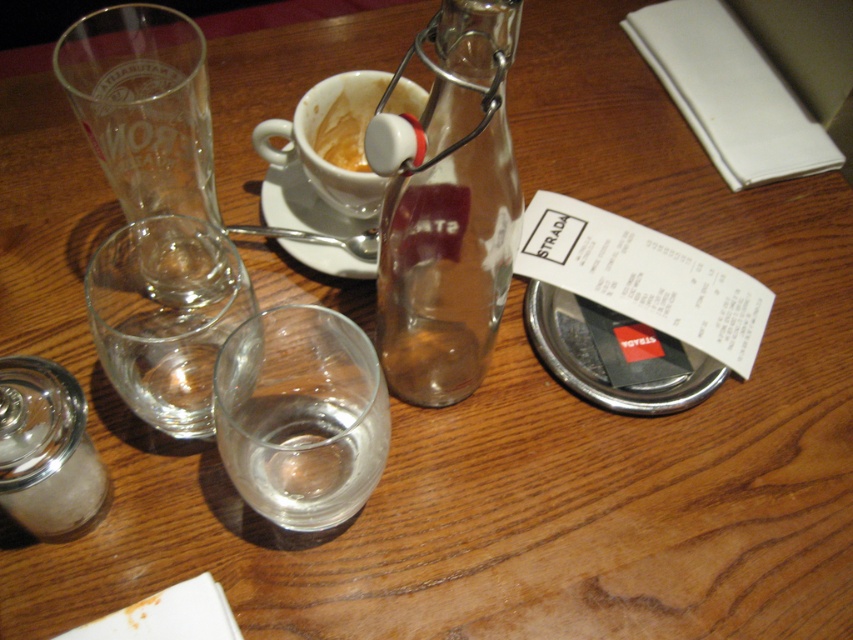
What do you see at coordinates (303, 204) in the screenshot? This screenshot has width=853, height=640. I see `white ceramic saucer at upper center` at bounding box center [303, 204].

Between white ceramic saucer at upper center and matte white cup at upper center, which one appears on the right side from the viewer's perspective?

Positioned to the right is matte white cup at upper center.

Who is more forward, (265, 218) or (363, 84)?

Point (363, 84) is in front.

The width and height of the screenshot is (853, 640). In order to click on white ceramic saucer at upper center in this screenshot , I will do `click(303, 204)`.

Between transparent glass bottle at center and white ceramic cup at upper center, which one appears on the left side from the viewer's perspective?

white ceramic cup at upper center is more to the left.

Between transparent glass bottle at center and white ceramic cup at upper center, which one appears on the right side from the viewer's perspective?

transparent glass bottle at center is more to the right.

Is point (415, 312) positioned after point (329, 140)?

No, (415, 312) is closer to viewer.

Locate an element on the screen. Image resolution: width=853 pixels, height=640 pixels. transparent glass bottle at center is located at coordinates (451, 211).

Which is more to the left, white ceramic cup at upper center or white ceramic saucer at upper center?

white ceramic saucer at upper center

Is white ceramic cup at upper center bigger than white ceramic saucer at upper center?

Correct, white ceramic cup at upper center is larger in size than white ceramic saucer at upper center.

Where is `white ceramic cup at upper center`? The width and height of the screenshot is (853, 640). white ceramic cup at upper center is located at coordinates (332, 140).